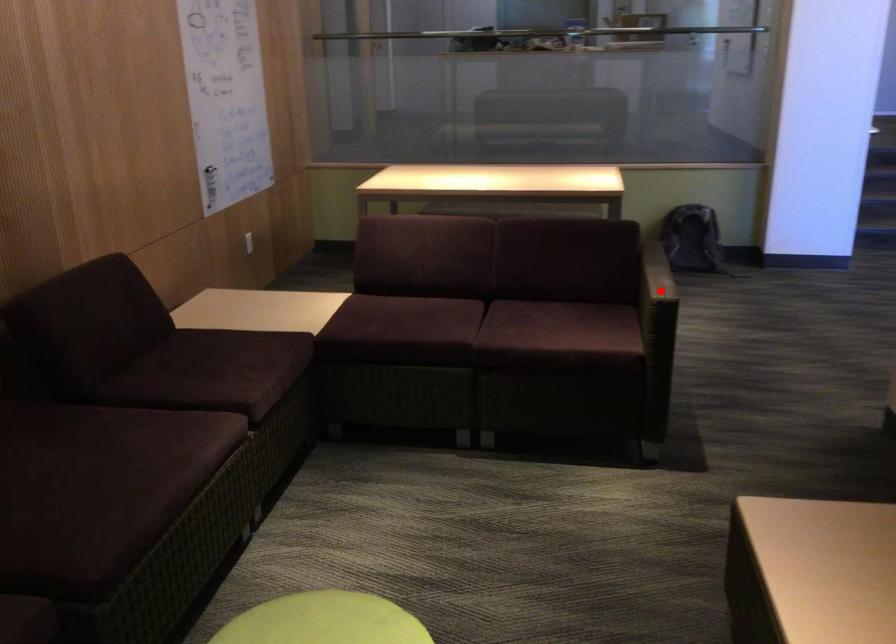
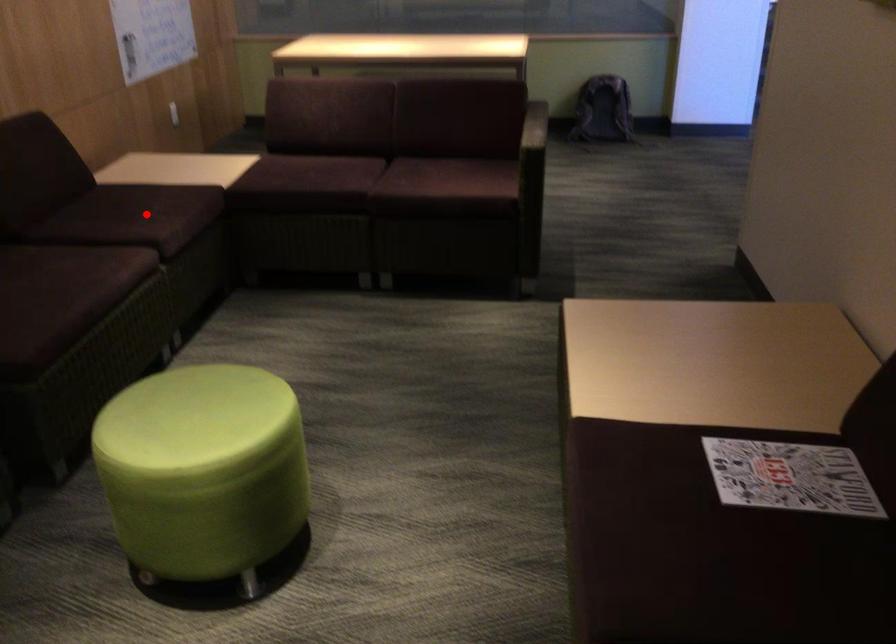
I am providing you with two images of the same scene from different viewpoints. A red point is marked on the first image and another point is marked on the second image. Is the red point in image1 aligned with the point shown in image2?

No